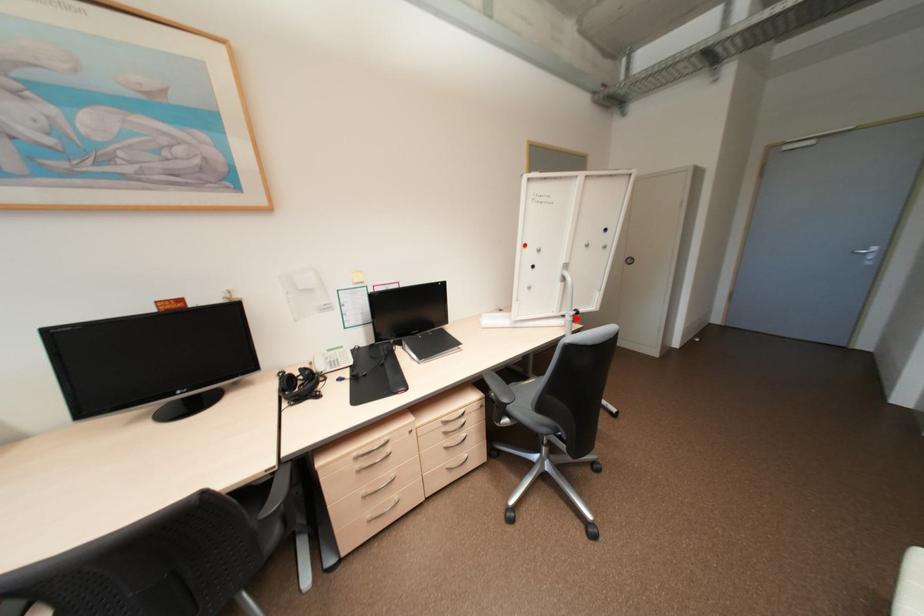
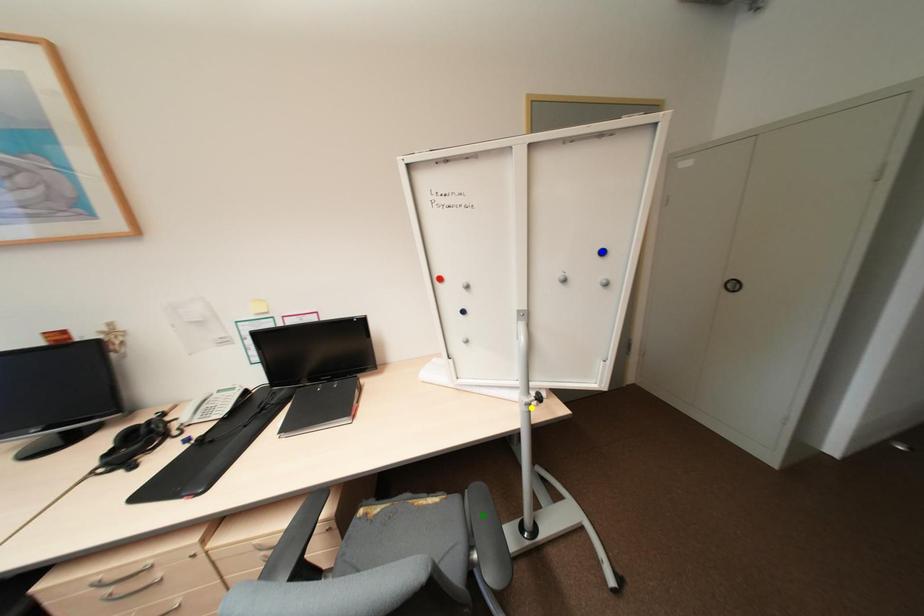
Question: I am providing you with two images of the same scene from different viewpoints. A red point is marked on the first image. You are given multiple points on the second image. Which spot in image 2 lines up with the point in image 1?

Choices:
 (A) green point
 (B) blue point
 (C) yellow point

Answer: (C)